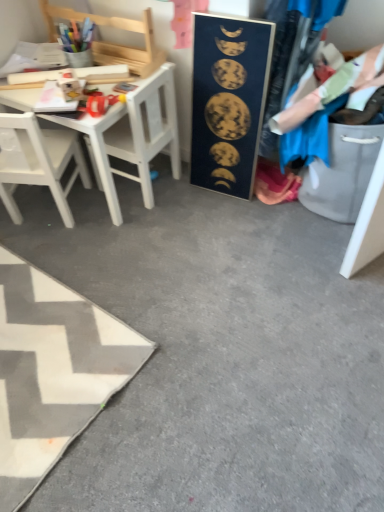
Question: From a real-world perspective, is white matte chair at left physically located above or below white wooden desk at upper left?

Choices:
 (A) above
 (B) below

Answer: (A)

Question: In terms of height, does white matte chair at left look taller or shorter compared to white wooden desk at upper left?

Choices:
 (A) short
 (B) tall

Answer: (B)

Question: Which of these objects is positioned farthest from the white matte chair at left, the 1th chair positioned from the bottom?

Choices:
 (A) white fabric rug at lower left
 (B) dark blue matte poster at center
 (C) white wooden desk at upper left
 (D) blue fabric at right
 (E) wooden chair at upper left, the 1th chair in the top-to-bottom sequence

Answer: (D)

Question: Estimate the real-world distances between objects in this image. Which object is farther from the white matte chair at left?

Choices:
 (A) dark blue matte poster at center
 (B) white fabric rug at lower left
 (C) wooden chair at upper left, the 2th chair when ordered from bottom to top
 (D) white matte chair at left, the 1th chair positioned from the bottom
 (E) blue fabric at right

Answer: (B)